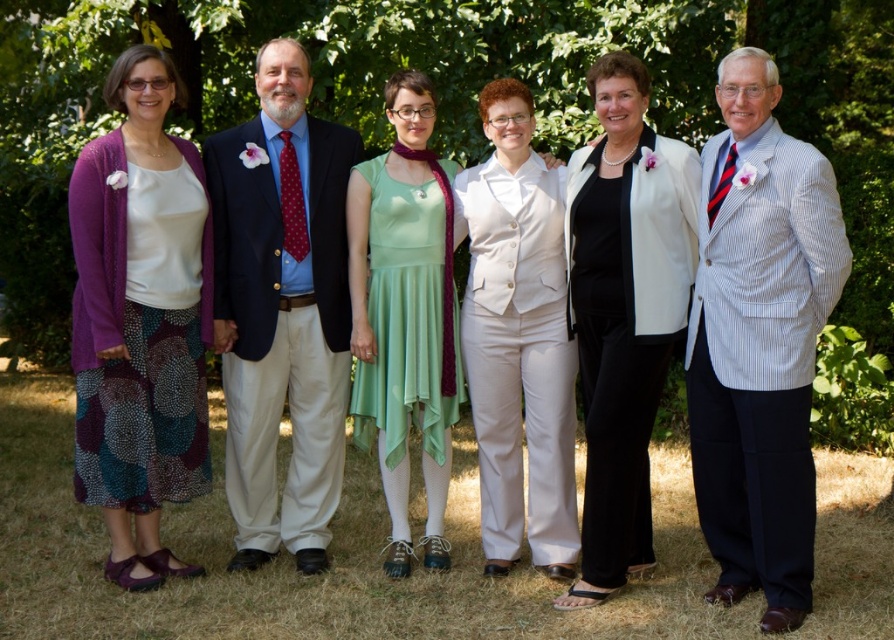
Question: Among these objects, which one is farthest from the camera?

Choices:
 (A) white matte blazer at center
 (B) white smooth vest at center
 (C) green satin dress at center
 (D) purple cardigan at left

Answer: (C)

Question: Which is farther from the white smooth vest at center?

Choices:
 (A) purple cardigan at left
 (B) striped cotton blazer at center

Answer: (A)

Question: Is purple cardigan at left thinner than white smooth vest at center?

Choices:
 (A) yes
 (B) no

Answer: (A)

Question: Is purple cardigan at left above white smooth vest at center?

Choices:
 (A) yes
 (B) no

Answer: (A)

Question: Which point is closer to the camera?

Choices:
 (A) (580, 177)
 (B) (157, 196)
 (C) (562, 444)
 (D) (808, 305)

Answer: (D)

Question: Can you confirm if striped cotton blazer at center is wider than green satin dress at center?

Choices:
 (A) no
 (B) yes

Answer: (B)